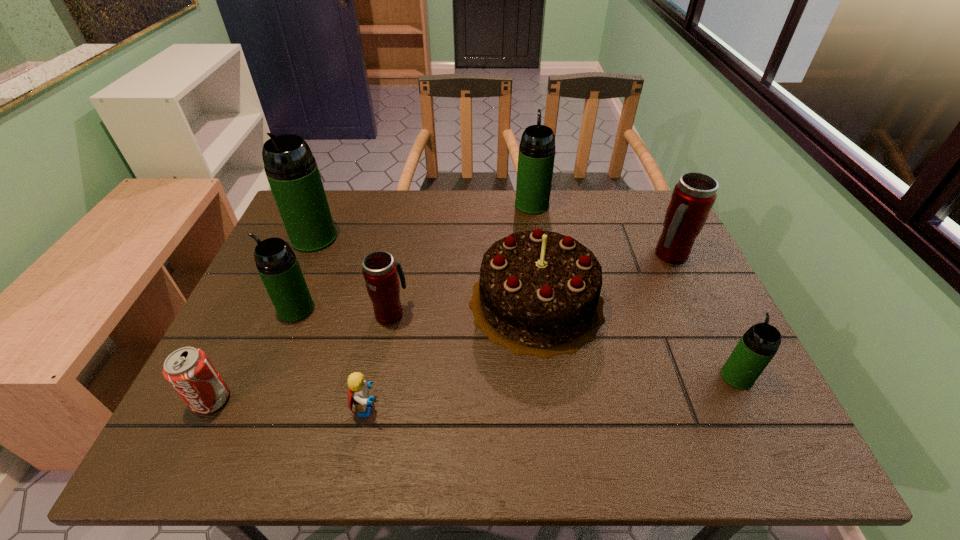
Image resolution: width=960 pixels, height=540 pixels. What are the coordinates of `vacant space located 0.210m from the spout of the rightmost green thermos bottle` in the screenshot? It's located at (698, 296).

You are a GUI agent. You are given a task and a screenshot of the screen. Output one action in this format:
    pyautogui.click(x=<x>, y=<y>)
    Task: Click on the blank area located 0.170m on the side with the handle of the left red thermos bottle
    Image resolution: width=960 pixels, height=540 pixels.
    Given the screenshot: What is the action you would take?
    pyautogui.click(x=401, y=256)

Where is `free space located on the side with the handle of the left red thermos bottle`? The height and width of the screenshot is (540, 960). free space located on the side with the handle of the left red thermos bottle is located at coordinates (402, 252).

Identify the location of vacant space located on the side with the handle of the left red thermos bottle. (405, 241).

Where is `free space located 0.180m on the right of the soda can`? The image size is (960, 540). free space located 0.180m on the right of the soda can is located at coordinates (315, 400).

You are a GUI agent. You are given a task and a screenshot of the screen. Output one action in this format:
    pyautogui.click(x=<x>, y=<y>)
    Task: Click on the vacant area situated on the front-facing side of the Lego
    The image size is (960, 540).
    Given the screenshot: What is the action you would take?
    pyautogui.click(x=445, y=408)

Where is `object that is positioned at the near edge`? The image size is (960, 540). object that is positioned at the near edge is located at coordinates (358, 393).

This screenshot has width=960, height=540. I want to click on soda can positioned at the left edge, so (188, 370).

Find the location of `object at the far left corner`. object at the far left corner is located at coordinates (292, 172).

At what (x,y) coordinates should I click in order to perform the action: click on vacant space at the far edge of the desktop. Please return your answer as a coordinate pair (x, y). Looking at the image, I should click on (358, 230).